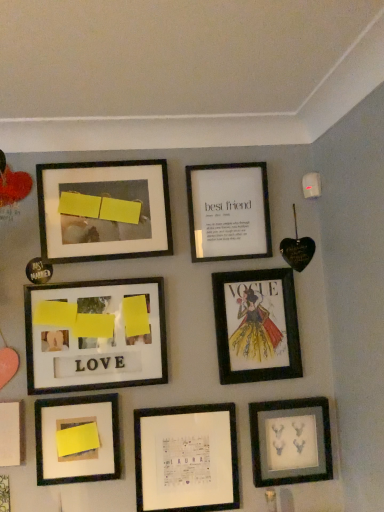
What is the approximate height of matte black deer heads at lower right, which is counted as the 7th picture frame, starting from the top?

matte black deer heads at lower right, which is counted as the 7th picture frame, starting from the top, is 26.75 centimeters tall.

At what (x,y) coordinates should I click in order to perform the action: click on matte black deer heads at lower right, acting as the third picture frame starting from the bottom. Please return your answer as a coordinate pair (x, y). Image resolution: width=384 pixels, height=512 pixels. Looking at the image, I should click on (290, 441).

Measure the distance between point (100,192) and camera.

Point (100,192) is 1.42 meters away from camera.

This screenshot has height=512, width=384. I want to click on white matte paper at lower left, the 5th picture frame from the bottom, so click(x=12, y=434).

The width and height of the screenshot is (384, 512). What do you see at coordinates (12, 434) in the screenshot? I see `white matte paper at lower left, the 5th picture frame from the bottom` at bounding box center [12, 434].

Describe the element at coordinates (186, 458) in the screenshot. The image size is (384, 512). I see `white paper at center, arranged as the 8th picture frame when viewed from the top` at that location.

At what (x,y) coordinates should I click in order to perform the action: click on matte black deer heads at lower right, which is counted as the 7th picture frame, starting from the top. Please return your answer as a coordinate pair (x, y). Image resolution: width=384 pixels, height=512 pixels. Looking at the image, I should click on (290, 441).

Is matte black deer heads at lower right, acting as the third picture frame starting from the bottom, at the back of matte black frame at upper left, which appears as the eighth picture frame when ordered from the bottom?

No, matte black frame at upper left, which appears as the eighth picture frame when ordered from the bottom, is not facing the opposite direction of matte black deer heads at lower right, acting as the third picture frame starting from the bottom.

From the image's perspective, who appears lower, matte black frame at upper left, the 2th picture frame viewed from the top, or matte black deer heads at lower right, which is counted as the 7th picture frame, starting from the top?

matte black deer heads at lower right, which is counted as the 7th picture frame, starting from the top, is shown below in the image.

Is matte black frame at upper left, which appears as the eighth picture frame when ordered from the bottom, far away from matte black deer heads at lower right, which is counted as the 7th picture frame, starting from the top?

No, matte black frame at upper left, which appears as the eighth picture frame when ordered from the bottom, is in close proximity to matte black deer heads at lower right, which is counted as the 7th picture frame, starting from the top.

Do you think matte black frame at upper left, the 2th picture frame viewed from the top, is within matte black deer heads at lower right, acting as the third picture frame starting from the bottom, or outside of it?

matte black frame at upper left, the 2th picture frame viewed from the top, is not enclosed by matte black deer heads at lower right, acting as the third picture frame starting from the bottom.

From the white matte paper at lower left, the 5th picture frame from the bottom, count 7th picture frames backward and point to it. Please provide its 2D coordinates.

[(256, 326)]

From a real-world perspective, is matte paper vogue cover at center right, the 7th picture frame from the bottom, located beneath white matte paper at lower left, the 5th picture frame from the bottom?

No.

Considering their positions, is matte paper vogue cover at center right, positioned as the 3th picture frame in top-to-bottom order, located in front of or behind white matte paper at lower left, the 5th picture frame in the top-to-bottom sequence?

matte paper vogue cover at center right, positioned as the 3th picture frame in top-to-bottom order, is behind white matte paper at lower left, the 5th picture frame in the top-to-bottom sequence.

Between matte paper vogue cover at center right, positioned as the 3th picture frame in top-to-bottom order, and white matte paper at lower left, the 5th picture frame from the bottom, which one has more height?

Standing taller between the two is matte paper vogue cover at center right, positioned as the 3th picture frame in top-to-bottom order.

What's the angular difference between matte yellow paper at center left, the 4th picture frame viewed from the top, and matte paper vogue cover at center right, the 7th picture frame from the bottom,'s facing directions?

There is a 0.348-degree angle between the facing directions of matte yellow paper at center left, the 4th picture frame viewed from the top, and matte paper vogue cover at center right, the 7th picture frame from the bottom.

Is the position of matte yellow paper at center left, placed as the sixth picture frame when sorted from bottom to top, less distant than that of matte paper vogue cover at center right, the 7th picture frame from the bottom?

Yes.

Can we say matte yellow paper at center left, placed as the sixth picture frame when sorted from bottom to top, lies outside matte paper vogue cover at center right, the 7th picture frame from the bottom?

Yes, matte yellow paper at center left, placed as the sixth picture frame when sorted from bottom to top, is located beyond the bounds of matte paper vogue cover at center right, the 7th picture frame from the bottom.

Is matte yellow paper at center left, the 4th picture frame viewed from the top, with matte paper vogue cover at center right, positioned as the 3th picture frame in top-to-bottom order?

matte yellow paper at center left, the 4th picture frame viewed from the top, and matte paper vogue cover at center right, positioned as the 3th picture frame in top-to-bottom order, are clearly separated.

Can you confirm if matte yellow sticky note at lower left, marked as the 4th picture frame in a bottom-to-top arrangement, is positioned to the left of matte black deer heads at lower right, which is counted as the 7th picture frame, starting from the top?

Yes.

What's the angular difference between matte yellow sticky note at lower left, marked as the 4th picture frame in a bottom-to-top arrangement, and matte black deer heads at lower right, acting as the third picture frame starting from the bottom,'s facing directions?

They differ by 1.38 degrees in their facing directions.

Considering the sizes of objects matte yellow sticky note at lower left, placed as the 6th picture frame when sorted from top to bottom, and matte black deer heads at lower right, which is counted as the 7th picture frame, starting from the top, in the image provided, who is taller, matte yellow sticky note at lower left, placed as the 6th picture frame when sorted from top to bottom, or matte black deer heads at lower right, which is counted as the 7th picture frame, starting from the top,?

matte black deer heads at lower right, which is counted as the 7th picture frame, starting from the top.

Does point (208, 407) come behind point (9, 504)?

Yes.

Which of these two, white paper at center, arranged as the 8th picture frame when viewed from the top, or matte black frame at upper left, arranged as the 9th picture frame when viewed from the top, is smaller?

With smaller size is matte black frame at upper left, arranged as the 9th picture frame when viewed from the top.

How different are the orientations of white paper at center, arranged as the 8th picture frame when viewed from the top, and matte black frame at upper left, which is counted as the first picture frame, starting from the bottom, in degrees?

The angle between the facing direction of white paper at center, arranged as the 8th picture frame when viewed from the top, and the facing direction of matte black frame at upper left, which is counted as the first picture frame, starting from the bottom, is 1.47 degrees.

Based on the photo, from a real-world perspective, between white paper at center, arranged as the 8th picture frame when viewed from the top, and matte black frame at upper left, arranged as the 9th picture frame when viewed from the top, who is vertically lower?

matte black frame at upper left, arranged as the 9th picture frame when viewed from the top.

How many degrees apart are the facing directions of matte black frame at upper left, which is counted as the first picture frame, starting from the bottom, and white matte paper at lower left, the 5th picture frame in the top-to-bottom sequence?

The facing directions of matte black frame at upper left, which is counted as the first picture frame, starting from the bottom, and white matte paper at lower left, the 5th picture frame in the top-to-bottom sequence, are 0.263 degrees apart.

Considering the positions of objects matte black frame at upper left, arranged as the 9th picture frame when viewed from the top, and white matte paper at lower left, the 5th picture frame from the bottom, in the image provided, who is more to the left, matte black frame at upper left, arranged as the 9th picture frame when viewed from the top, or white matte paper at lower left, the 5th picture frame from the bottom,?

white matte paper at lower left, the 5th picture frame from the bottom.

Considering the points (7, 477) and (18, 444), which point is in front, point (7, 477) or point (18, 444)?

The point (7, 477) is closer to the camera.

From the white matte paper at lower left, the 5th picture frame from the bottom, count 1st picture frame to the right and point to it. Please provide its 2D coordinates.

[(4, 494)]

Is white paper at upper center, arranged as the 9th picture frame when ordered from the bottom, aimed at matte black deer heads at lower right, which is counted as the 7th picture frame, starting from the top?

No, white paper at upper center, arranged as the 9th picture frame when ordered from the bottom, is not oriented towards matte black deer heads at lower right, which is counted as the 7th picture frame, starting from the top.

From the image's perspective, between white paper at upper center, which appears as the 1th picture frame when viewed from the top, and matte black deer heads at lower right, acting as the third picture frame starting from the bottom, who is located below?

matte black deer heads at lower right, acting as the third picture frame starting from the bottom, is shown below in the image.

Which picture frame is the 2nd one when counting from the front of the white paper at upper center, arranged as the 9th picture frame when ordered from the bottom? Please provide its 2D coordinates.

[(290, 441)]

Is white paper at upper center, arranged as the 9th picture frame when ordered from the bottom, thinner than matte black deer heads at lower right, which is counted as the 7th picture frame, starting from the top?

Yes.

Locate an element on the screen. picture frame that is the 5th one when counting downward from the matte black frame at upper left, which appears as the eighth picture frame when ordered from the bottom (from the image's perspective) is located at coordinates click(290, 441).

From a real-world perspective, which picture frame is the 2nd one underneath the matte paper vogue cover at center right, the 7th picture frame from the bottom? Please provide its 2D coordinates.

[(12, 434)]

Estimate the real-world distances between objects in this image. Which object is closer to matte black deer heads at lower right, which is counted as the 7th picture frame, starting from the top, matte black frame at upper left, which is counted as the first picture frame, starting from the bottom, or matte yellow paper at center left, the 4th picture frame viewed from the top?

Based on the image, matte yellow paper at center left, the 4th picture frame viewed from the top, appears to be nearer to matte black deer heads at lower right, which is counted as the 7th picture frame, starting from the top.

From the image, which object appears to be nearer to matte yellow sticky note at lower left, placed as the 6th picture frame when sorted from top to bottom, white paper at center, arranged as the 8th picture frame when viewed from the top, or white matte paper at lower left, the 5th picture frame from the bottom?

white matte paper at lower left, the 5th picture frame from the bottom, is closer to matte yellow sticky note at lower left, placed as the 6th picture frame when sorted from top to bottom.

Looking at the image, which one is located further to white paper at center, arranged as the 8th picture frame when viewed from the top, matte yellow sticky note at lower left, placed as the 6th picture frame when sorted from top to bottom, or matte black frame at upper left, arranged as the 9th picture frame when viewed from the top?

The object further to white paper at center, arranged as the 8th picture frame when viewed from the top, is matte black frame at upper left, arranged as the 9th picture frame when viewed from the top.

From the image, which object appears to be nearer to white matte paper at lower left, the 5th picture frame in the top-to-bottom sequence, matte yellow sticky note at lower left, marked as the 4th picture frame in a bottom-to-top arrangement, or matte paper vogue cover at center right, positioned as the 3th picture frame in top-to-bottom order?

Among the two, matte yellow sticky note at lower left, marked as the 4th picture frame in a bottom-to-top arrangement, is located nearer to white matte paper at lower left, the 5th picture frame in the top-to-bottom sequence.

Estimate the real-world distances between objects in this image. Which object is closer to matte paper vogue cover at center right, the 7th picture frame from the bottom, white paper at center, which appears as the second picture frame when ordered from the bottom, or matte black frame at upper left, arranged as the 9th picture frame when viewed from the top?

white paper at center, which appears as the second picture frame when ordered from the bottom, lies closer to matte paper vogue cover at center right, the 7th picture frame from the bottom, than the other object.

From the image, which object appears to be farther from matte black frame at upper left, which is counted as the first picture frame, starting from the bottom, matte yellow paper at center left, the 4th picture frame viewed from the top, or white paper at upper center, which appears as the 1th picture frame when viewed from the top?

white paper at upper center, which appears as the 1th picture frame when viewed from the top, lies further to matte black frame at upper left, which is counted as the first picture frame, starting from the bottom, than the other object.

Based on the photo, from the image, which object appears to be nearer to white matte paper at lower left, the 5th picture frame from the bottom, white paper at upper center, which appears as the 1th picture frame when viewed from the top, or matte yellow sticky note at lower left, marked as the 4th picture frame in a bottom-to-top arrangement?

matte yellow sticky note at lower left, marked as the 4th picture frame in a bottom-to-top arrangement, is positioned closer to the anchor white matte paper at lower left, the 5th picture frame from the bottom.

Estimate the real-world distances between objects in this image. Which object is further from matte yellow paper at center left, placed as the sixth picture frame when sorted from bottom to top, matte black frame at upper left, which is counted as the first picture frame, starting from the bottom, or white paper at center, arranged as the 8th picture frame when viewed from the top?

matte black frame at upper left, which is counted as the first picture frame, starting from the bottom, lies further to matte yellow paper at center left, placed as the sixth picture frame when sorted from bottom to top, than the other object.

This screenshot has width=384, height=512. Identify the location of picture frame between white matte paper at lower left, the 5th picture frame in the top-to-bottom sequence, and matte yellow sticky note at lower left, marked as the 4th picture frame in a bottom-to-top arrangement, from left to right. (4, 494).